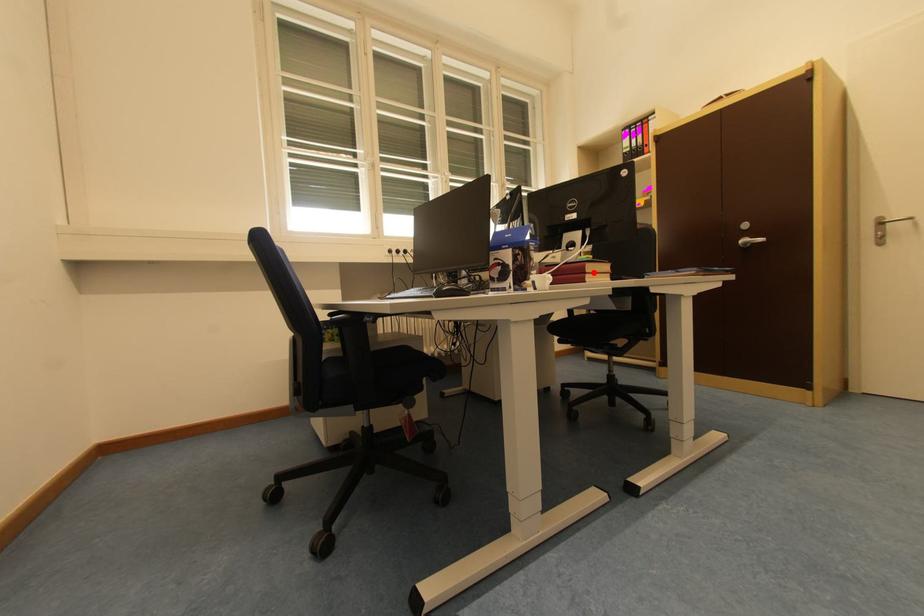
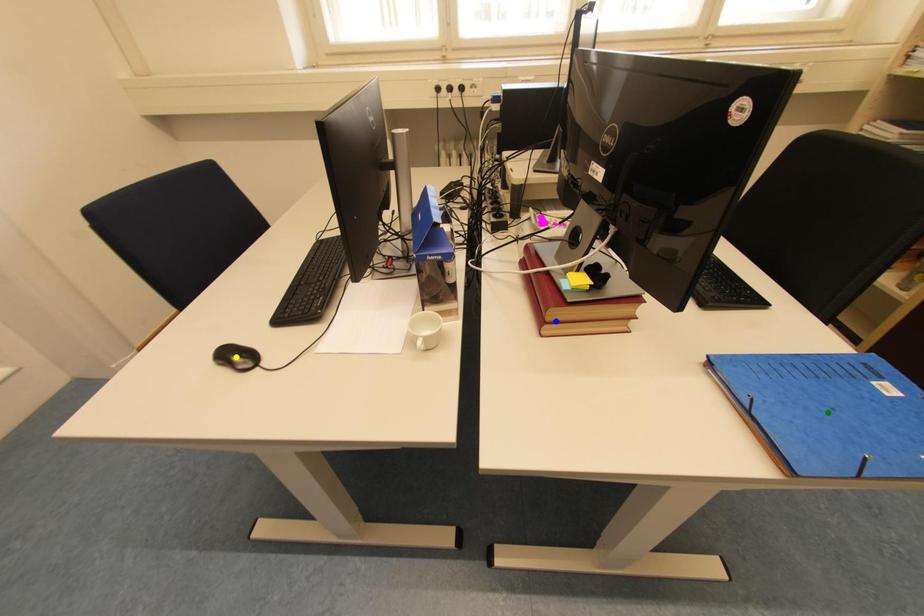
Question: I am providing you with two images of the same scene from different viewpoints. A red point is marked on the first image. You are given multiple points on the second image. Which mark in image 2 goes with the point in image 1?

Choices:
 (A) blue point
 (B) yellow point
 (C) green point

Answer: (A)